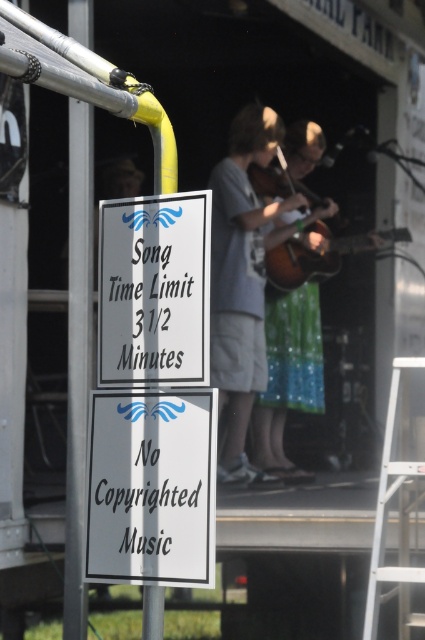
Is white paper sign at center to the left of brown wooden guitar at center from the viewer's perspective?

Correct, you'll find white paper sign at center to the left of brown wooden guitar at center.

Which is more to the right, white paper sign at center or brown wooden guitar at center?

Positioned to the right is brown wooden guitar at center.

Is point (192, 340) less distant than point (365, 232)?

Yes, it is in front of point (365, 232).

Identify the location of white paper sign at center. The width and height of the screenshot is (425, 640). (155, 289).

Between white paper sign at lower center and brown wooden guitar at center, which one is positioned lower?

Positioned lower is white paper sign at lower center.

Does white paper sign at lower center lie in front of brown wooden guitar at center?

Yes, it is.

Between point (112, 532) and point (265, 256), which one is positioned in front?

Point (112, 532) is in front.

Identify the location of white paper sign at lower center. (152, 486).

Does white paper sign at lower center appear on the left side of white paper sign at center?

Indeed, white paper sign at lower center is positioned on the left side of white paper sign at center.

Is white paper sign at lower center shorter than white paper sign at center?

Yes, white paper sign at lower center is shorter than white paper sign at center.

At what (x,y) coordinates should I click in order to perform the action: click on white paper sign at lower center. Please return your answer as a coordinate pair (x, y). This screenshot has width=425, height=640. Looking at the image, I should click on (152, 486).